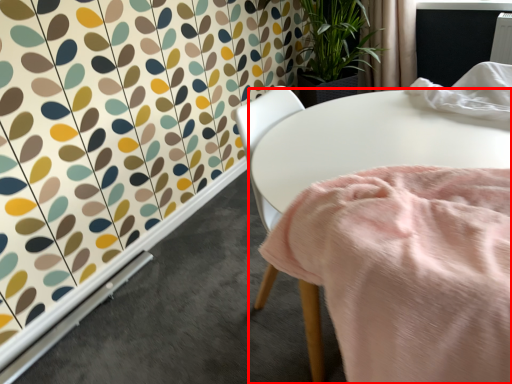
Question: From the image's perspective, where is table (annotated by the red box) located in relation to curtain in the image?

Choices:
 (A) below
 (B) above

Answer: (A)